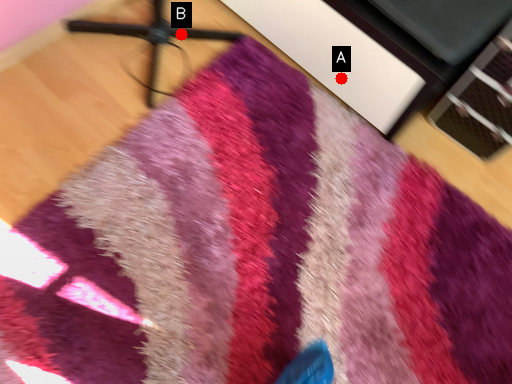
Question: Two points are circled on the image, labeled by A and B beside each circle. Which point is closer to the camera?

Choices:
 (A) A is closer
 (B) B is closer

Answer: (A)